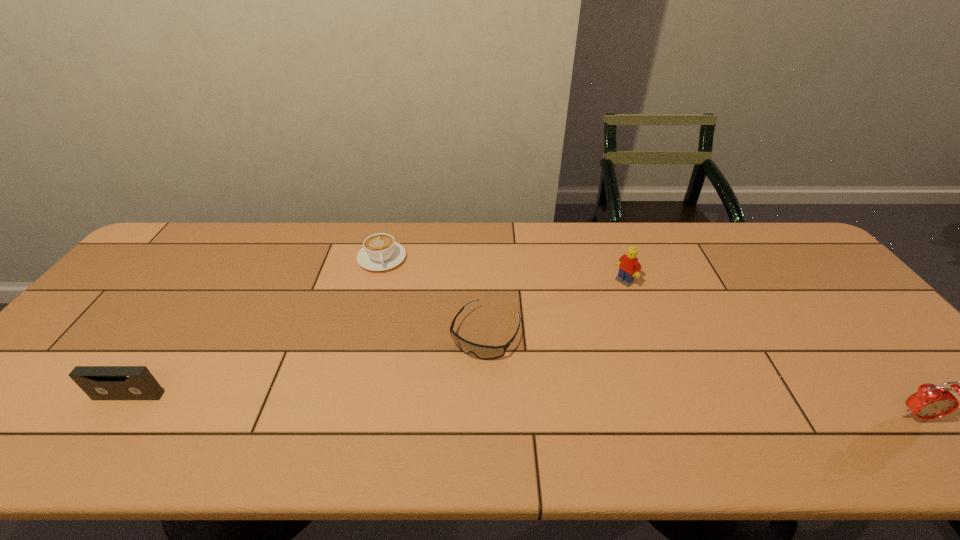
Identify the location of free space on the desktop that is between the third shortest object and the alarm clock and is positioned on the lenses of the goggles. The width and height of the screenshot is (960, 540). (444, 404).

Locate an element on the screen. The height and width of the screenshot is (540, 960). free spot on the desktop that is between the videotape and the alarm clock and is positioned on the front-facing side of the fourth object from left to right is located at coordinates (x=447, y=404).

This screenshot has height=540, width=960. Identify the location of vacant space on the desktop that is between the leftmost object and the alarm clock and is positioned on the side of the second object from left to right with the handle. (404, 403).